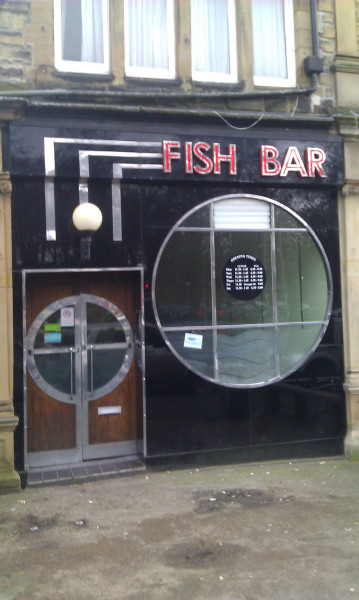
Image resolution: width=359 pixels, height=600 pixels. I want to click on brown door, so click(x=48, y=428).